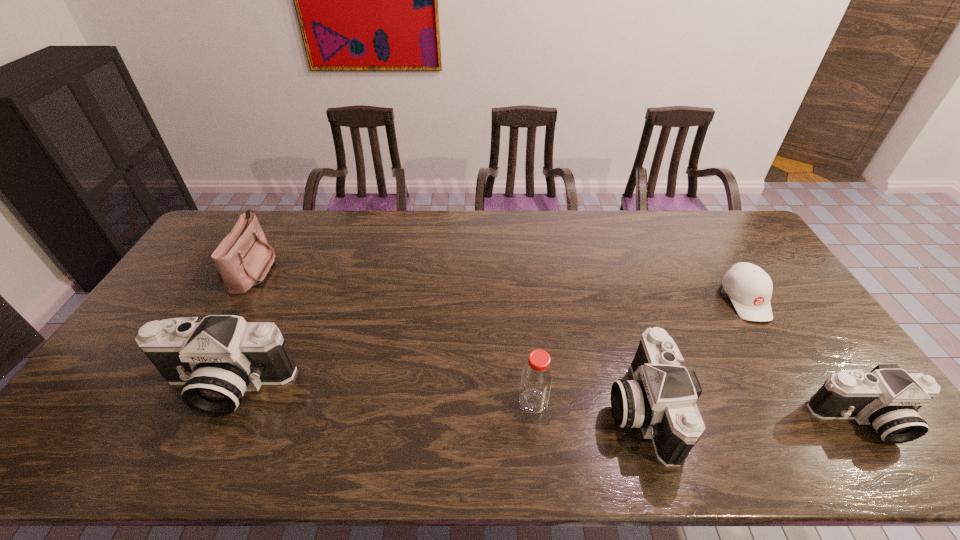
At what (x,y) coordinates should I click in order to perform the action: click on object located at the near left corner. Please return your answer as a coordinate pair (x, y). The image size is (960, 540). Looking at the image, I should click on (216, 360).

The image size is (960, 540). Identify the location of object that is at the near right corner. (888, 398).

In the image, there is a desktop. At what (x,y) coordinates should I click in order to perform the action: click on free space at the far edge. Please return your answer as a coordinate pair (x, y). Looking at the image, I should click on (542, 221).

Image resolution: width=960 pixels, height=540 pixels. In order to click on vacant space at the near edge in this screenshot , I will do `click(556, 411)`.

I want to click on vacant position at the left edge of the desktop, so click(x=165, y=298).

What are the coordinates of `free space at the right edge of the desktop` in the screenshot? It's located at (735, 262).

Image resolution: width=960 pixels, height=540 pixels. In the image, there is a desktop. In order to click on free space at the far right corner in this screenshot , I will do `click(743, 227)`.

Image resolution: width=960 pixels, height=540 pixels. I want to click on vacant region between the bottle and the leftmost camera, so click(x=379, y=394).

Find the location of a particular element. The image size is (960, 540). free spot between the shortest object and the second camera from right to left is located at coordinates (693, 354).

Locate an element on the screen. free space between the leftmost camera and the bottle is located at coordinates (379, 394).